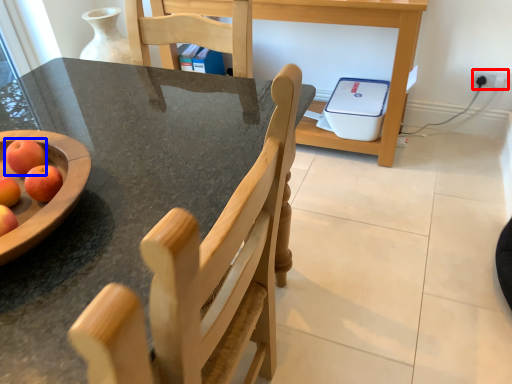
Question: Which of the following is the farthest to the observer, electric outlet (highlighted by a red box) or apple (highlighted by a blue box)?

Choices:
 (A) electric outlet
 (B) apple

Answer: (A)